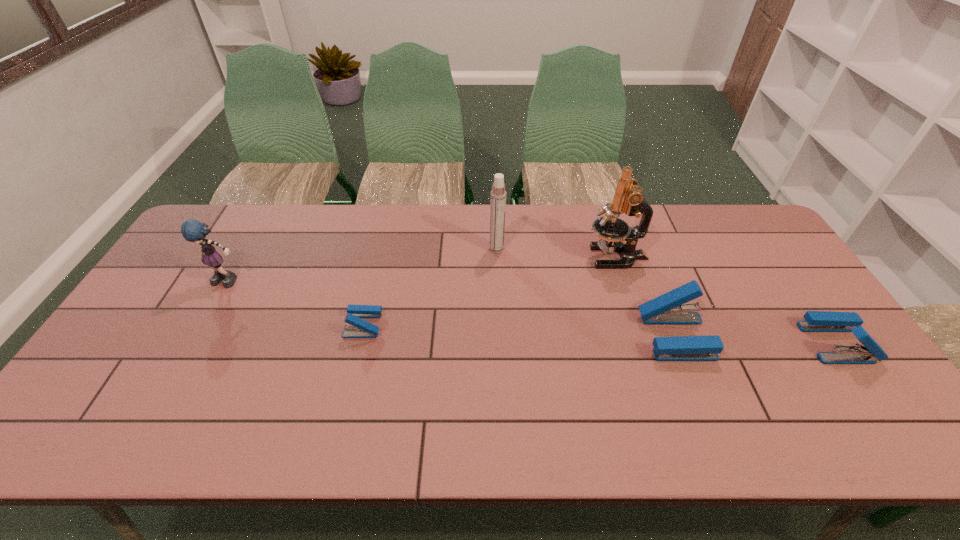
Find the location of `vacant space located 0.160m on the right of the leftmost stapler`. vacant space located 0.160m on the right of the leftmost stapler is located at coordinates (441, 325).

Find the location of a particular element. The height and width of the screenshot is (540, 960). vacant area situated on the right of the second stapler from right to left is located at coordinates pyautogui.click(x=782, y=337).

At what (x,y) coordinates should I click in order to perform the action: click on vacant region located on the back of the rightmost stapler. Please return your answer as a coordinate pair (x, y). Looking at the image, I should click on (775, 254).

You are a GUI agent. You are given a task and a screenshot of the screen. Output one action in this format:
    pyautogui.click(x=<x>, y=<y>)
    Task: Click on the vacant space situated on the left of the fourth object from right to left
    
    Given the screenshot: What is the action you would take?
    pyautogui.click(x=400, y=249)

I want to click on free region located at the eyepiece of the microscope, so click(x=569, y=257).

Locate an element on the screen. free point located 0.370m at the eyepiece of the microscope is located at coordinates (468, 257).

At what (x,y) coordinates should I click in order to perform the action: click on vacant space located 0.400m at the eyepiece of the microscope. Please return your answer as a coordinate pair (x, y). Image resolution: width=960 pixels, height=540 pixels. Looking at the image, I should click on (460, 257).

The width and height of the screenshot is (960, 540). Identify the location of free spot located on the front-facing side of the third farthest object. (211, 313).

Where is `aerosol can that is at the far edge`? The width and height of the screenshot is (960, 540). aerosol can that is at the far edge is located at coordinates (498, 194).

Identify the location of microscope that is positioned at the far edge. (628, 198).